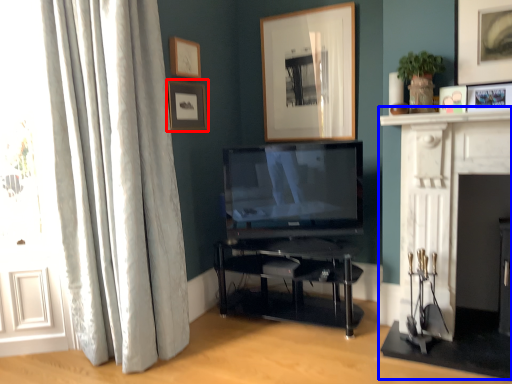
Question: Which object appears farthest to the camera in this image, picture frame (highlighted by a red box) or fireplace (highlighted by a blue box)?

Choices:
 (A) picture frame
 (B) fireplace

Answer: (A)